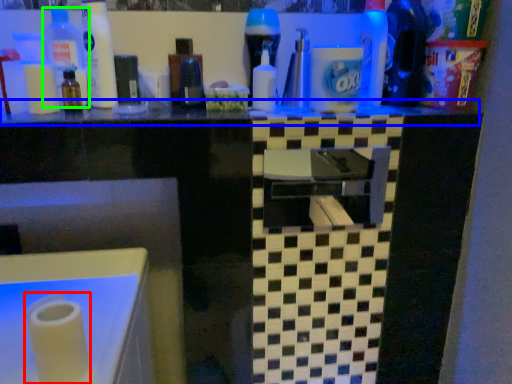
Question: Which object is positioned farthest from paper towel (highlighted by a red box)? Select from counter top (highlighted by a blue box) and bottle (highlighted by a green box).

Choices:
 (A) counter top
 (B) bottle

Answer: (B)